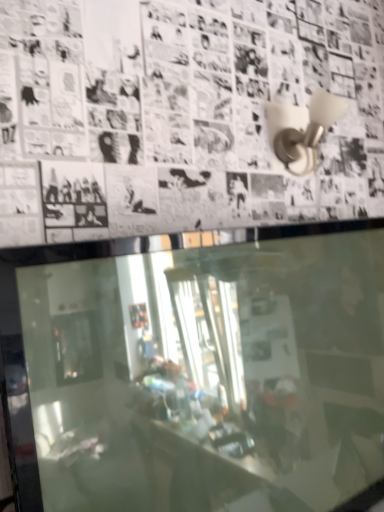
The width and height of the screenshot is (384, 512). In order to click on clear glass mirror at center in this screenshot , I will do `click(200, 374)`.

The width and height of the screenshot is (384, 512). Describe the element at coordinates (200, 374) in the screenshot. I see `clear glass mirror at center` at that location.

Locate an element on the screen. clear glass mirror at center is located at coordinates (200, 374).